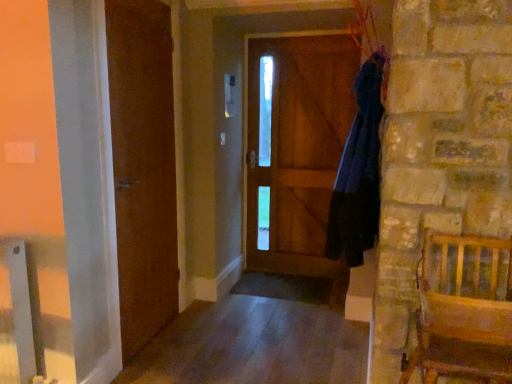
Question: Relative to brown wooden door at left, is smooth wood floor at lower center in front or behind?

Choices:
 (A) behind
 (B) front

Answer: (B)

Question: Considering the positions of smooth wood floor at lower center and brown wooden door at left in the image, is smooth wood floor at lower center taller or shorter than brown wooden door at left?

Choices:
 (A) short
 (B) tall

Answer: (A)

Question: Based on their relative distances, which object is farther from the smooth wood floor at lower center?

Choices:
 (A) wooden screen door at center
 (B) brown wooden door at left
 (C) wooden chair at right
 (D) dark blue fabric at right

Answer: (A)

Question: Based on their relative distances, which object is farther from the brown wooden door at left?

Choices:
 (A) wooden screen door at center
 (B) smooth wood floor at lower center
 (C) wooden chair at right
 (D) dark blue fabric at right

Answer: (C)